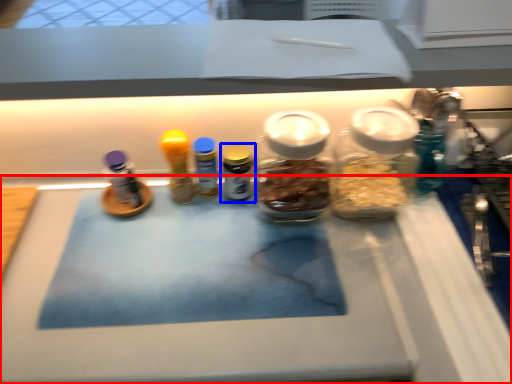
Question: Which point is further to the camera, table (highlighted by a red box) or bottle (highlighted by a blue box)?

Choices:
 (A) table
 (B) bottle

Answer: (B)